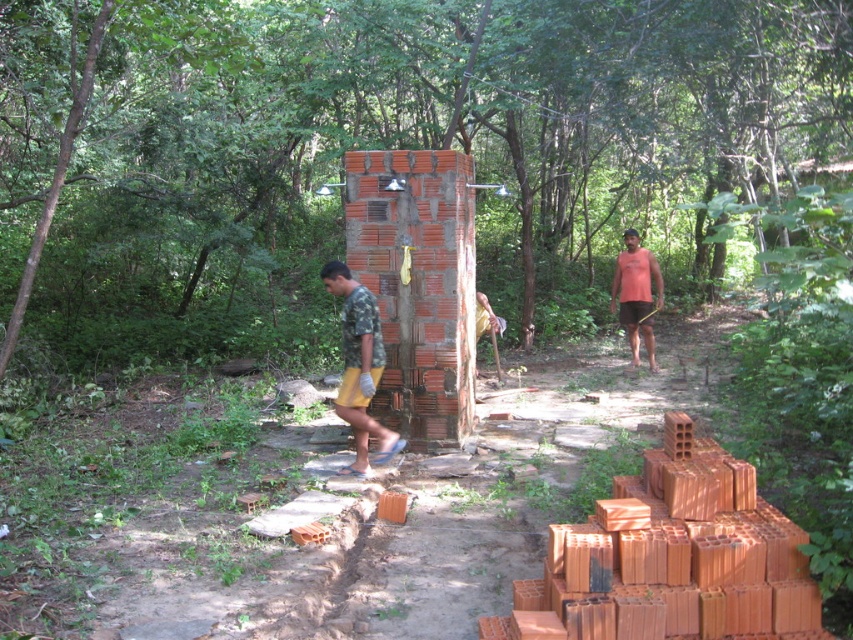
Question: Is camouflage fabric shirt at center closer to the viewer compared to orange tank top at right?

Choices:
 (A) yes
 (B) no

Answer: (A)

Question: Which point is closer to the camera taking this photo?

Choices:
 (A) [x=340, y=385]
 (B) [x=633, y=257]

Answer: (A)

Question: Does camouflage fabric shirt at center have a smaller size compared to orange tank top at right?

Choices:
 (A) no
 (B) yes

Answer: (B)

Question: Is camouflage fabric shirt at center smaller than orange tank top at right?

Choices:
 (A) no
 (B) yes

Answer: (B)